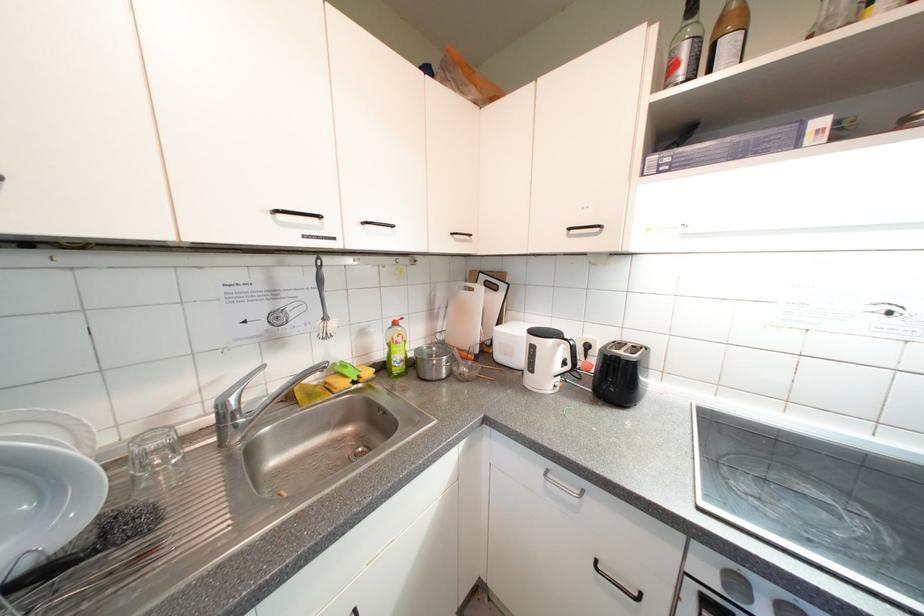
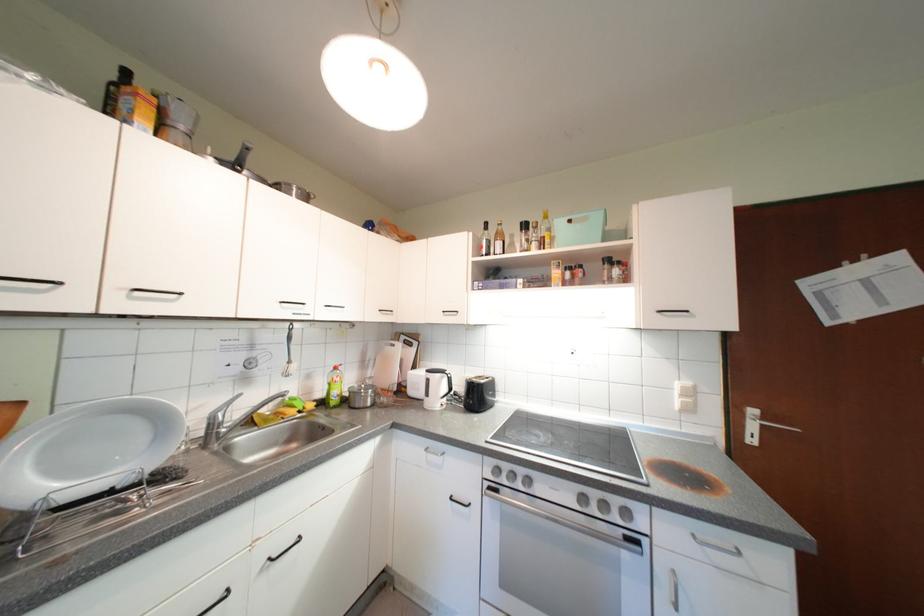
In the second image, find the point that corresponds to [553,477] in the first image.

(433, 453)